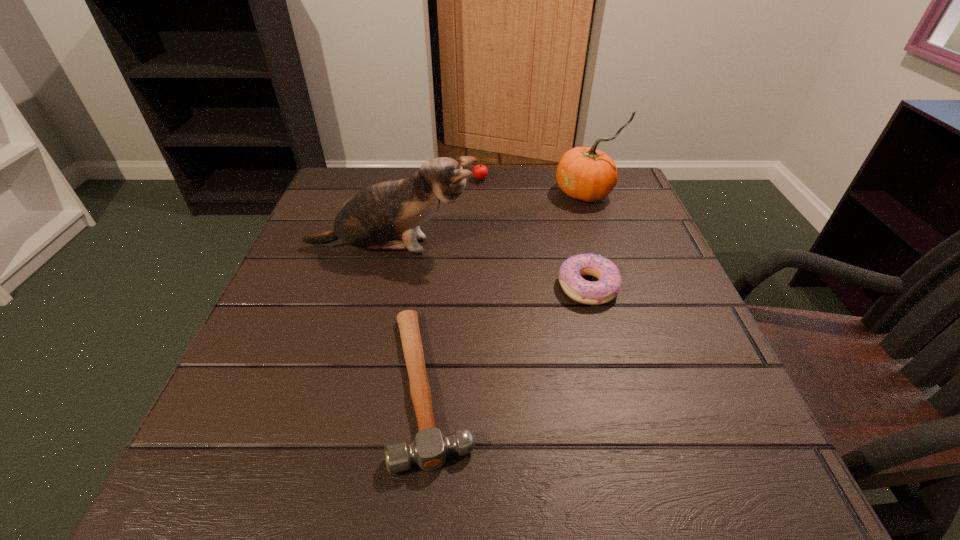
Locate an element on the screen. The width and height of the screenshot is (960, 540). vacant space situated on the left of the fourth farthest object is located at coordinates (532, 287).

I want to click on vacant space located on the right of the hammer, so click(720, 386).

The height and width of the screenshot is (540, 960). Identify the location of pumpkin that is at the far edge. (584, 173).

You are a GUI agent. You are given a task and a screenshot of the screen. Output one action in this format:
    pyautogui.click(x=<x>, y=<y>)
    Task: Click on the cherry that is at the far edge
    The height and width of the screenshot is (540, 960).
    Given the screenshot: What is the action you would take?
    pyautogui.click(x=480, y=171)

You are a GUI agent. You are given a task and a screenshot of the screen. Output one action in this format:
    pyautogui.click(x=<x>, y=<y>)
    Task: Click on the object positioned at the near edge
    This screenshot has height=540, width=960.
    Given the screenshot: What is the action you would take?
    pyautogui.click(x=429, y=450)

Image resolution: width=960 pixels, height=540 pixels. Identify the location of object that is at the left edge. (387, 215).

Locate an element on the screen. This screenshot has height=540, width=960. pumpkin at the right edge is located at coordinates (584, 173).

This screenshot has width=960, height=540. Find the location of `doughnut at the right edge`. doughnut at the right edge is located at coordinates (602, 291).

Find the location of a particular element. object at the far right corner is located at coordinates (584, 173).

Where is `vacant space at the far edge of the desktop`? This screenshot has width=960, height=540. vacant space at the far edge of the desktop is located at coordinates click(x=502, y=209).